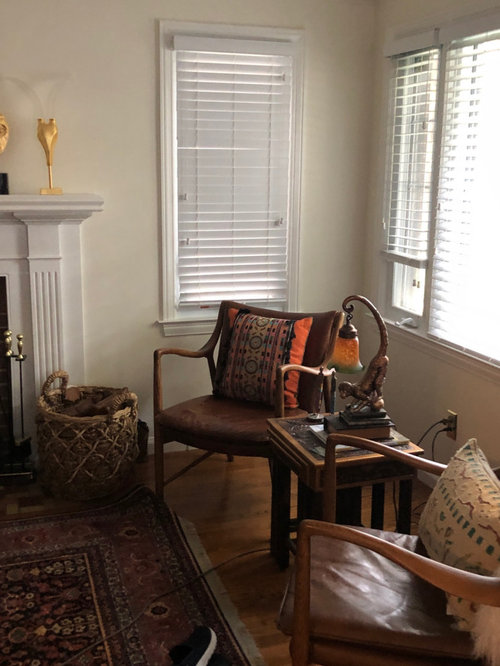
You are a GUI agent. You are given a task and a screenshot of the screen. Output one action in this format:
    pyautogui.click(x=<x>, y=<y>)
    Task: Click on the lamp
    The image size is (500, 666).
    Given the screenshot: What is the action you would take?
    pyautogui.click(x=354, y=354)